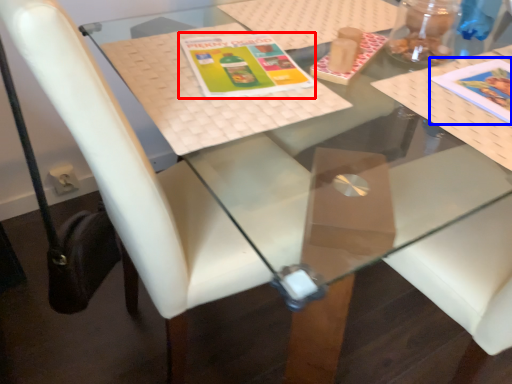
Question: Which of the following is the farthest to the observer, book cover (highlighted by a red box) or book cover (highlighted by a blue box)?

Choices:
 (A) book cover
 (B) book cover

Answer: (A)